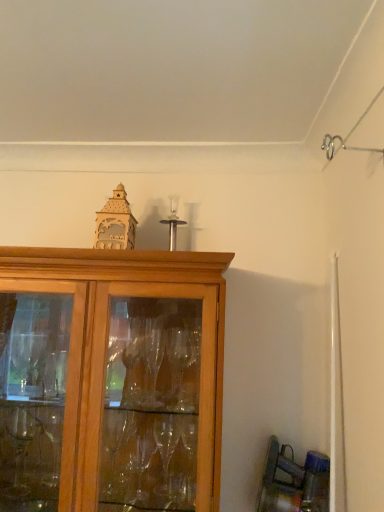
Where is `wooden cabinet at center`? The height and width of the screenshot is (512, 384). wooden cabinet at center is located at coordinates (111, 380).

What do you see at coordinates (111, 380) in the screenshot? I see `wooden cabinet at center` at bounding box center [111, 380].

Identify the location of wooden cabinet at center. This screenshot has height=512, width=384. (111, 380).